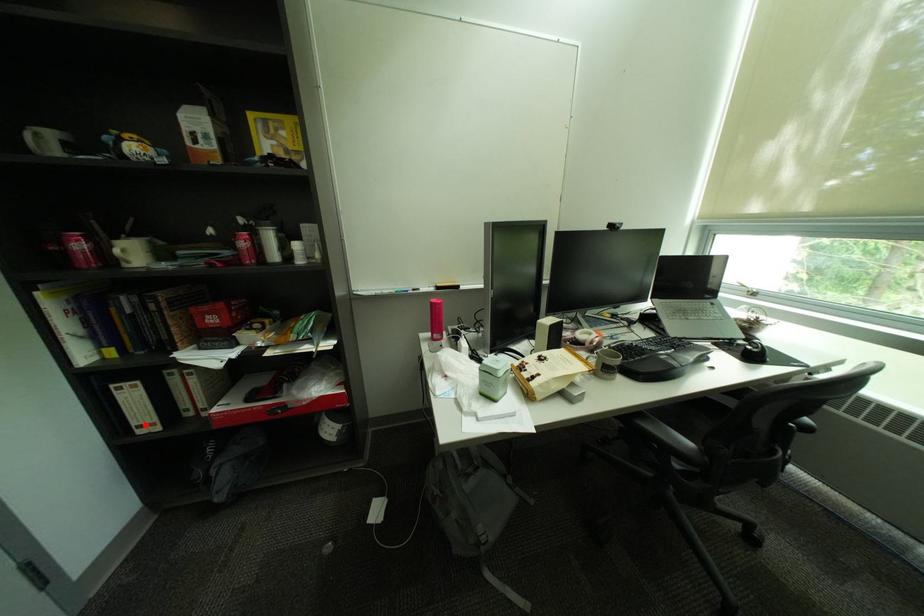
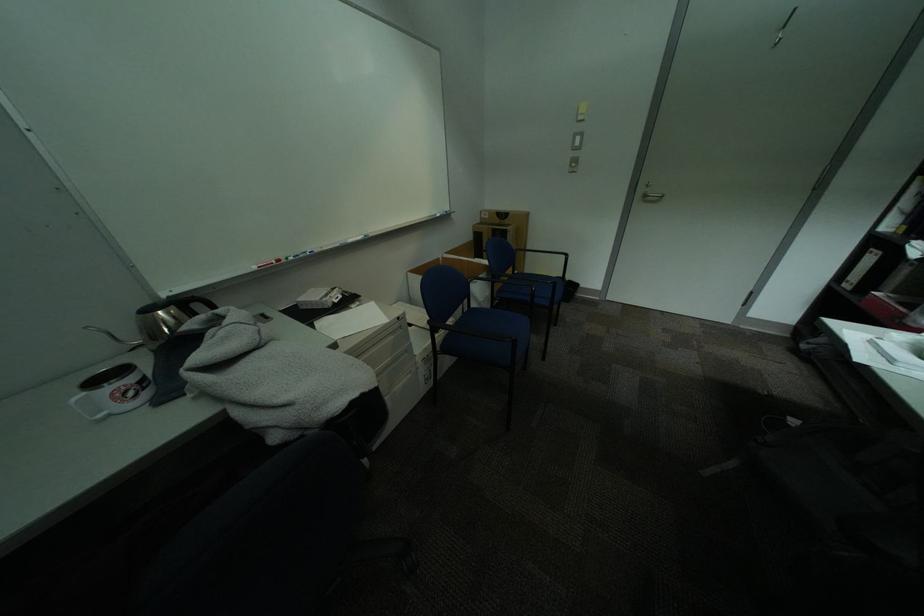
Find the pixel in the second image that matches the highlighted location in the first image.

(859, 280)